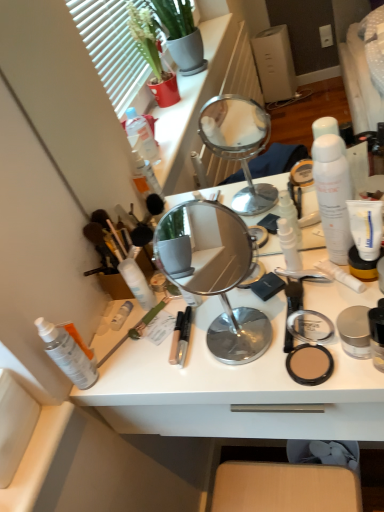
At what (x,y) coordinates should I click in order to perform the action: click on vacant area that lies between matte beige compact at right and green matte brush at center. Please return your answer as a coordinate pair (x, y). The image size is (384, 512). Looking at the image, I should click on (200, 355).